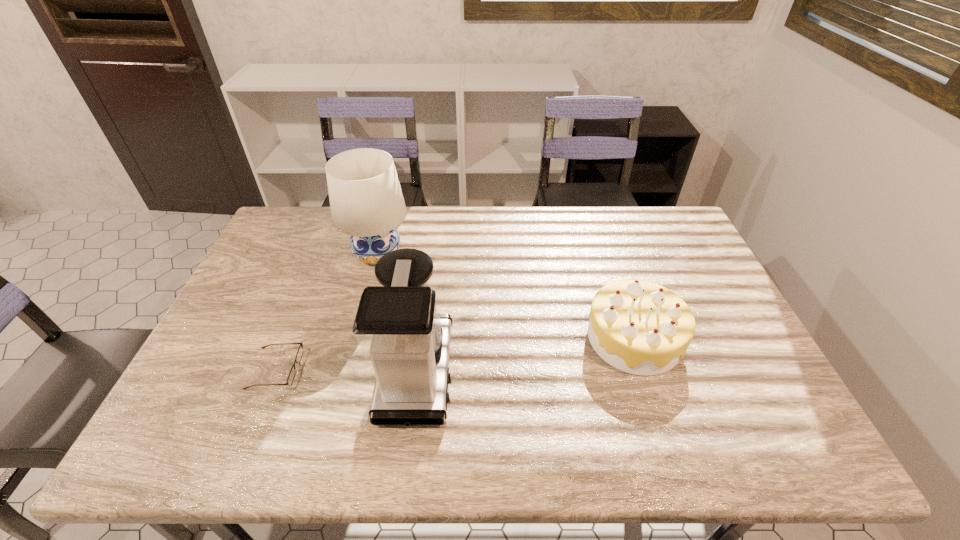
You are a GUI agent. You are given a task and a screenshot of the screen. Output one action in this format:
    pyautogui.click(x=<x>, y=<y>)
    Task: Click on the lampshade
    
    Given the screenshot: What is the action you would take?
    pyautogui.click(x=366, y=201)

Find the location of a particular element. coffee maker is located at coordinates (398, 326).

You are a GUI agent. You are given a task and a screenshot of the screen. Output one action in this format:
    pyautogui.click(x=<x>, y=<y>)
    Task: Click on the third tallest object
    
    Given the screenshot: What is the action you would take?
    pyautogui.click(x=639, y=327)

Where is `the rightmost object`? The height and width of the screenshot is (540, 960). the rightmost object is located at coordinates (639, 327).

At what (x,y) coordinates should I click in order to perform the action: click on the leftmost object. Please return your answer as a coordinate pair (x, y). The image size is (960, 540). Looking at the image, I should click on pos(299,354).

Where is `spectacles`? Image resolution: width=960 pixels, height=540 pixels. spectacles is located at coordinates (299, 354).

At what (x,y) coordinates should I click in order to perform the action: click on free space located 0.060m on the front-facing side of the farthest object. Please return your answer as a coordinate pair (x, y). Looking at the image, I should click on tap(368, 291).

Identify the location of vacant space situated 0.140m at the front of the coffee maker where the controls are located. The height and width of the screenshot is (540, 960). (509, 372).

You are a GUI agent. You are given a task and a screenshot of the screen. Output one action in this format:
    pyautogui.click(x=<x>, y=<y>)
    Task: Click on the free spot located 0.110m on the back of the rightmost object
    This screenshot has width=960, height=540.
    Given the screenshot: What is the action you would take?
    pyautogui.click(x=614, y=278)

I want to click on vacant area located 0.080m on the front-facing side of the leftmost object, so click(x=329, y=369).